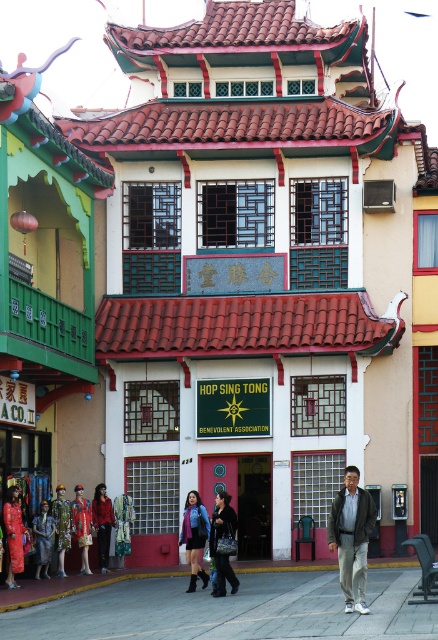
You are attending a cultural event at the HOP SING TONG Benevolent Association and notice two people wearing a dark gray jacket at center and a green floral dress at center. Which clothing item is taller?

The dark gray jacket at center is taller than the green floral dress at center.